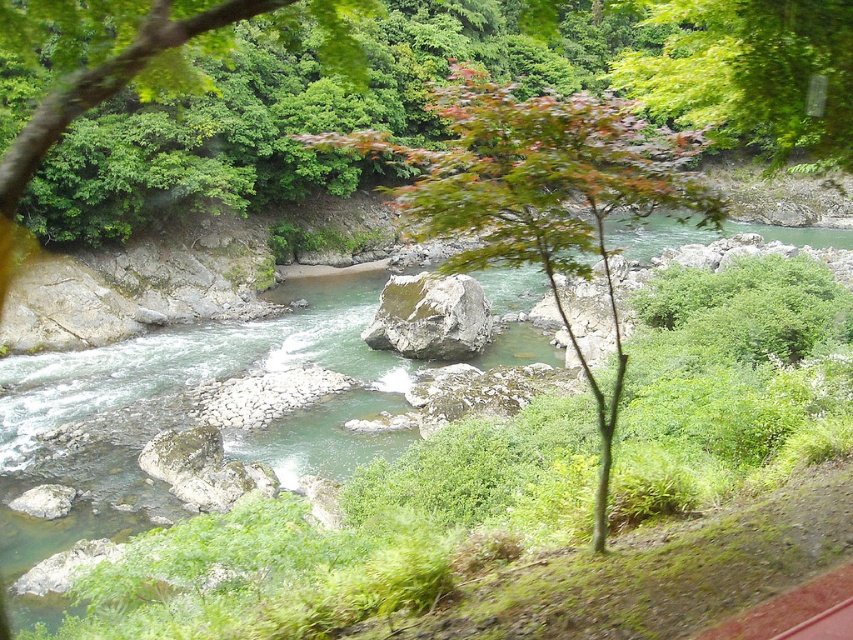
Question: Among these objects, which one is nearest to the camera?

Choices:
 (A) green leafy tree at upper center
 (B) green leafy tree at center

Answer: (B)

Question: Among these points, which one is farthest from the camera?

Choices:
 (A) (404, 289)
 (B) (503, 93)
 (C) (805, 140)

Answer: (A)

Question: Which of these objects is positioned closest to the green leafy tree at upper center?

Choices:
 (A) gray/rough rock at center
 (B) green leafy tree at center

Answer: (A)

Question: Can you confirm if green leafy tree at center is thinner than gray/rough rock at center?

Choices:
 (A) no
 (B) yes

Answer: (A)

Question: Is green leafy tree at center further to camera compared to gray/rough rock at center?

Choices:
 (A) yes
 (B) no

Answer: (B)

Question: Does green leafy tree at upper center appear on the left side of gray/rough rock at center?

Choices:
 (A) yes
 (B) no

Answer: (B)